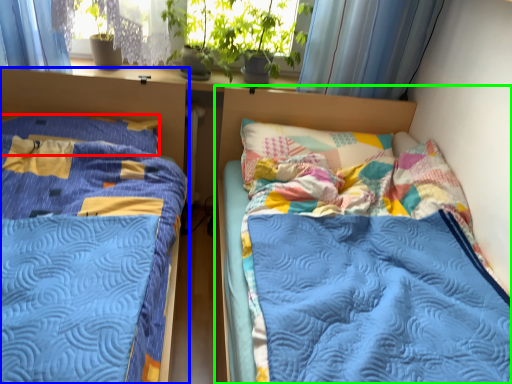
Question: Which is farther away from pillow (highlighted by a red box)? bed (highlighted by a blue box) or bed (highlighted by a green box)?

Choices:
 (A) bed
 (B) bed

Answer: (B)